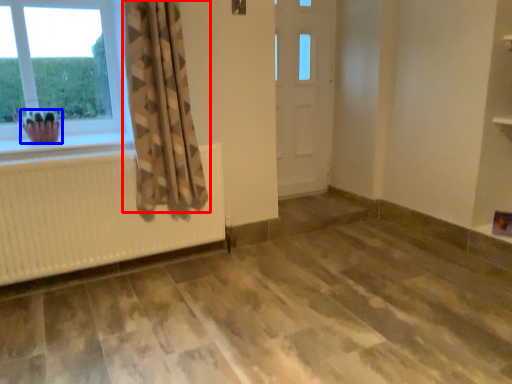
Question: Which object appears farthest to the camera in this image, curtain (highlighted by a red box) or plant (highlighted by a blue box)?

Choices:
 (A) curtain
 (B) plant

Answer: (B)